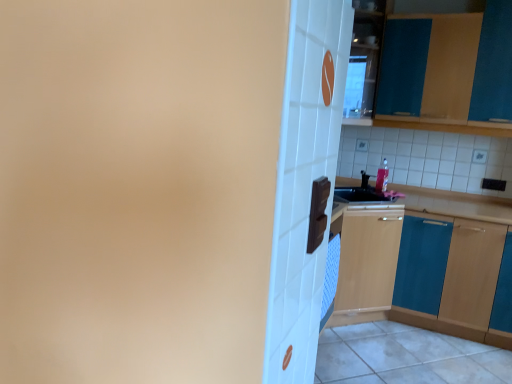
Question: From a real-world perspective, is teal wood cabinet at upper right, the 2th cabinetry ordered from the bottom, under teal wood cabinet at right, marked as the 2th cabinetry in a top-to-bottom arrangement?

Choices:
 (A) no
 (B) yes

Answer: (A)

Question: Is teal wood cabinet at upper right, the 2th cabinetry ordered from the bottom, at the right side of teal wood cabinet at right, marked as the 2th cabinetry in a top-to-bottom arrangement?

Choices:
 (A) yes
 (B) no

Answer: (B)

Question: Is teal wood cabinet at upper right, the 2th cabinetry ordered from the bottom, beside teal wood cabinet at right, placed as the first cabinetry when sorted from bottom to top?

Choices:
 (A) yes
 (B) no

Answer: (B)

Question: From the image's perspective, does teal wood cabinet at upper right, the 2th cabinetry ordered from the bottom, appear lower than teal wood cabinet at right, placed as the first cabinetry when sorted from bottom to top?

Choices:
 (A) no
 (B) yes

Answer: (A)

Question: Is teal wood cabinet at upper right, positioned as the first cabinetry in top-to-bottom order, facing away from teal wood cabinet at right, placed as the first cabinetry when sorted from bottom to top?

Choices:
 (A) yes
 (B) no

Answer: (B)

Question: From the image's perspective, is teal wood cabinet at upper right, positioned as the first cabinetry in top-to-bottom order, over teal wood cabinet at right, placed as the first cabinetry when sorted from bottom to top?

Choices:
 (A) yes
 (B) no

Answer: (A)

Question: Is white glossy tile at lower right looking in the opposite direction of teal wood cabinet at upper right, positioned as the first cabinetry in top-to-bottom order?

Choices:
 (A) no
 (B) yes

Answer: (A)

Question: Could you tell me if white glossy tile at lower right is turned towards teal wood cabinet at upper right, the 2th cabinetry ordered from the bottom?

Choices:
 (A) no
 (B) yes

Answer: (A)

Question: Is white glossy tile at lower right in contact with teal wood cabinet at upper right, positioned as the first cabinetry in top-to-bottom order?

Choices:
 (A) no
 (B) yes

Answer: (A)

Question: Is white glossy tile at lower right at the left side of teal wood cabinet at upper right, the 2th cabinetry ordered from the bottom?

Choices:
 (A) yes
 (B) no

Answer: (A)

Question: Is white glossy tile at lower right completely or partially outside of teal wood cabinet at upper right, positioned as the first cabinetry in top-to-bottom order?

Choices:
 (A) yes
 (B) no

Answer: (A)

Question: Is white glossy tile at lower right thinner than teal wood cabinet at upper right, the 2th cabinetry ordered from the bottom?

Choices:
 (A) yes
 (B) no

Answer: (B)

Question: From a real-world perspective, is teal wood cabinet at upper right, positioned as the first cabinetry in top-to-bottom order, on top of white glossy tile at lower right?

Choices:
 (A) yes
 (B) no

Answer: (A)